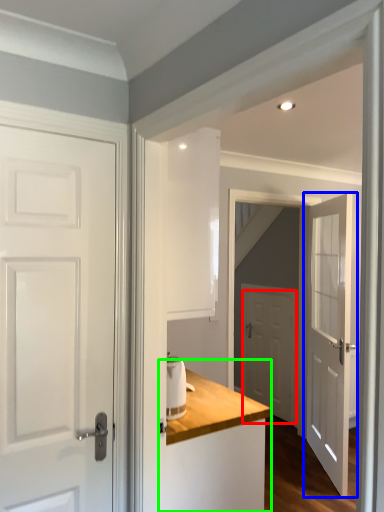
Question: Which is nearer to the door (highlighted by a red box)? door (highlighted by a blue box) or dresser (highlighted by a green box).

Choices:
 (A) door
 (B) dresser

Answer: (A)